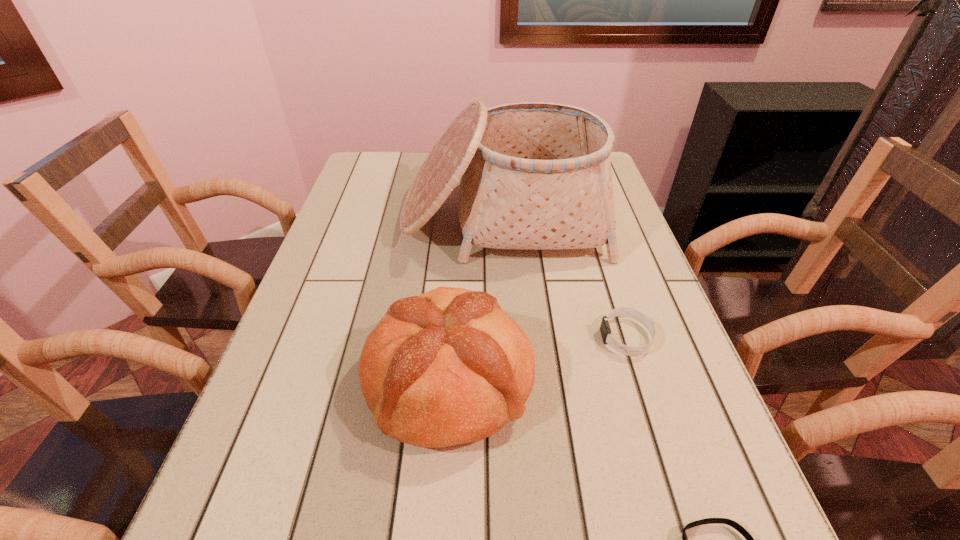
You are a GUI agent. You are given a task and a screenshot of the screen. Output one action in this format:
    pyautogui.click(x=<x>, y=<y>)
    Task: Click on the object that is the nearest to the farthest object
    This screenshot has height=540, width=960.
    Given the screenshot: What is the action you would take?
    pyautogui.click(x=605, y=330)

What are the coordinates of `object that ranks as the second closest to the bread` in the screenshot? It's located at (534, 175).